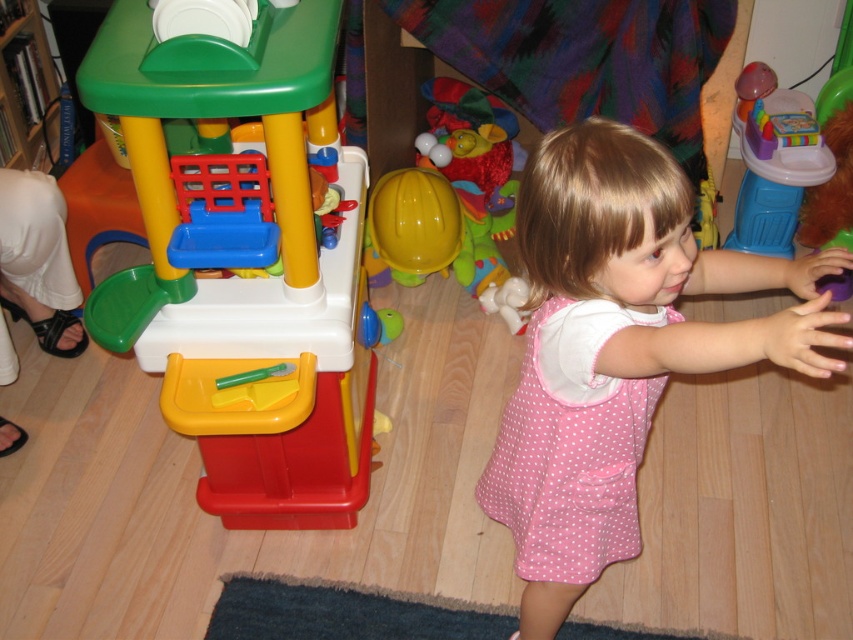
Question: Where is pink dotted dress at center located in relation to yellow plastic hard hat at center in the image?

Choices:
 (A) left
 (B) right

Answer: (B)

Question: Can you confirm if plastic play kitchen at left is positioned above yellow plastic hard hat at center?

Choices:
 (A) no
 (B) yes

Answer: (A)

Question: Observing the image, what is the correct spatial positioning of plastic play kitchen at left in reference to yellow plastic hard hat at center?

Choices:
 (A) above
 (B) below

Answer: (B)

Question: Based on their relative distances, which object is farther from the translucent plastic toy at right?

Choices:
 (A) pink dotted dress at center
 (B) yellow plastic hard hat at center
 (C) pink polka dot dress at center
 (D) plastic play kitchen at left

Answer: (D)

Question: Based on their relative distances, which object is nearer to the pink dotted dress at center?

Choices:
 (A) pink polka dot dress at center
 (B) plastic play kitchen at left
 (C) translucent plastic toy at right
 (D) yellow plastic hard hat at center

Answer: (A)

Question: Which is nearer to the translucent plastic toy at right?

Choices:
 (A) plastic play kitchen at left
 (B) pink dotted dress at center
 (C) yellow plastic hard hat at center
 (D) pink polka dot dress at center

Answer: (C)